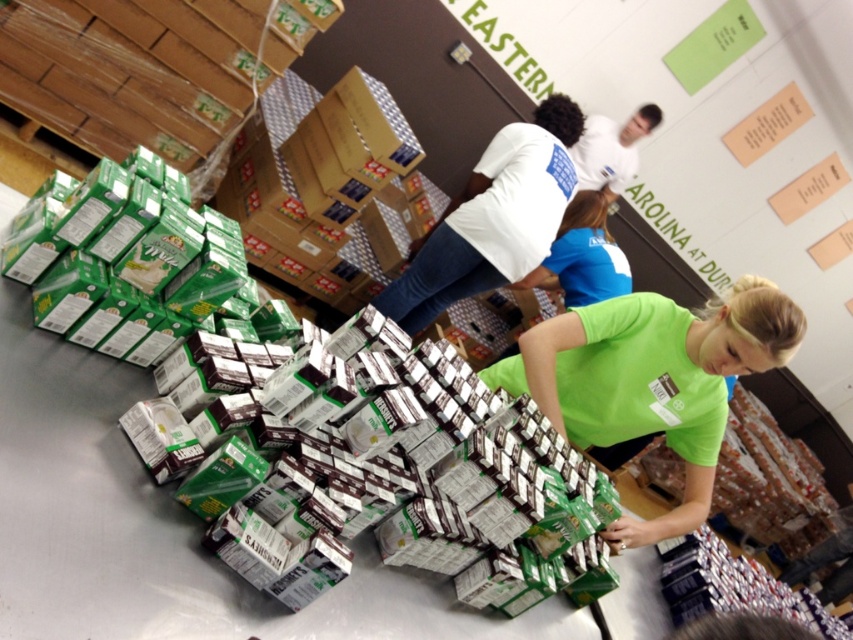
Question: Which of the following is the farthest from the observer?

Choices:
 (A) (631, 541)
 (B) (547, 225)

Answer: (B)

Question: Does green matte shirt at center have a smaller size compared to white cotton shirt at center?

Choices:
 (A) yes
 (B) no

Answer: (A)

Question: Among these objects, which one is farthest from the camera?

Choices:
 (A) white cotton shirt at center
 (B) green matte shirt at center

Answer: (A)

Question: From the image, what is the correct spatial relationship of green matte shirt at center in relation to white cotton shirt at center?

Choices:
 (A) left
 (B) right

Answer: (B)

Question: In this image, where is green matte shirt at center located relative to white cotton shirt at center?

Choices:
 (A) above
 (B) below

Answer: (B)